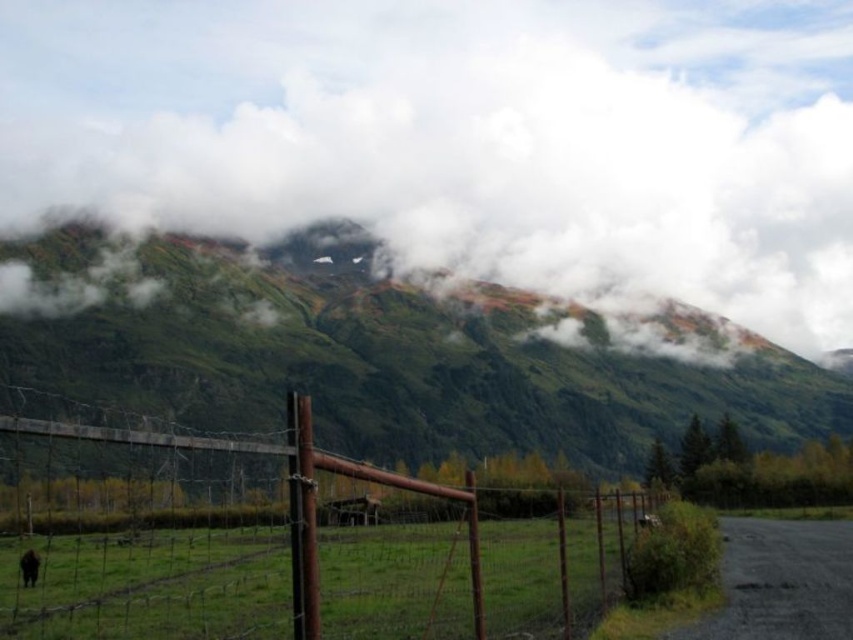
Question: Which point is farther from the camera taking this photo?

Choices:
 (A) (21, 573)
 (B) (164, 340)
 (C) (730, 252)

Answer: (C)

Question: Among these objects, which one is nearest to the camera?

Choices:
 (A) green grassy hill at center
 (B) rusty wire fence at center

Answer: (B)

Question: Can you confirm if green grassy hill at center is bigger than rusty wire fence at center?

Choices:
 (A) yes
 (B) no

Answer: (A)

Question: Is cloudy sky at upper center closer to the viewer compared to rusty wire fence at center?

Choices:
 (A) no
 (B) yes

Answer: (A)

Question: Which point is closer to the camera?

Choices:
 (A) (38, 576)
 (B) (581, 268)
 (C) (694, 312)
 (D) (234, 531)

Answer: (A)

Question: Does cloudy sky at upper center have a lesser width compared to brown furry dog at lower left?

Choices:
 (A) yes
 (B) no

Answer: (B)